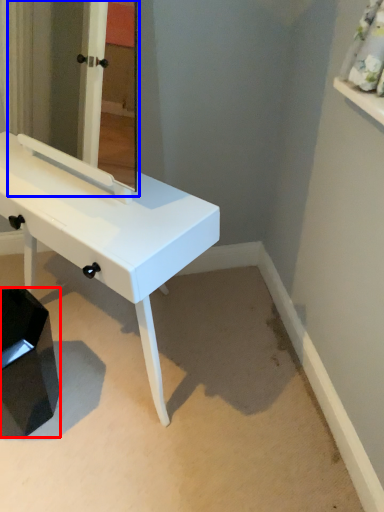
Question: Which object appears farthest to the camera in this image, step stool (highlighted by a red box) or mirror (highlighted by a blue box)?

Choices:
 (A) step stool
 (B) mirror

Answer: (A)